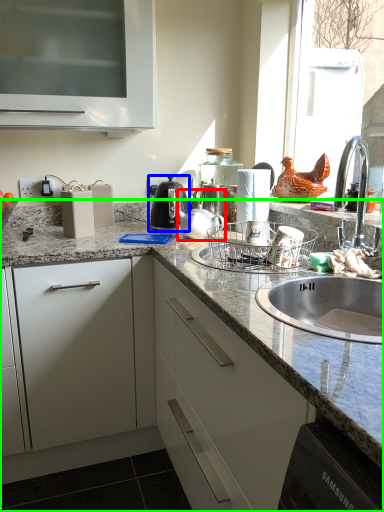
Question: Which object is positioned closest to tea pot (highlighted by a red box)? Select from coffeepot (highlighted by a blue box) and countertop (highlighted by a green box).

Choices:
 (A) coffeepot
 (B) countertop

Answer: (A)